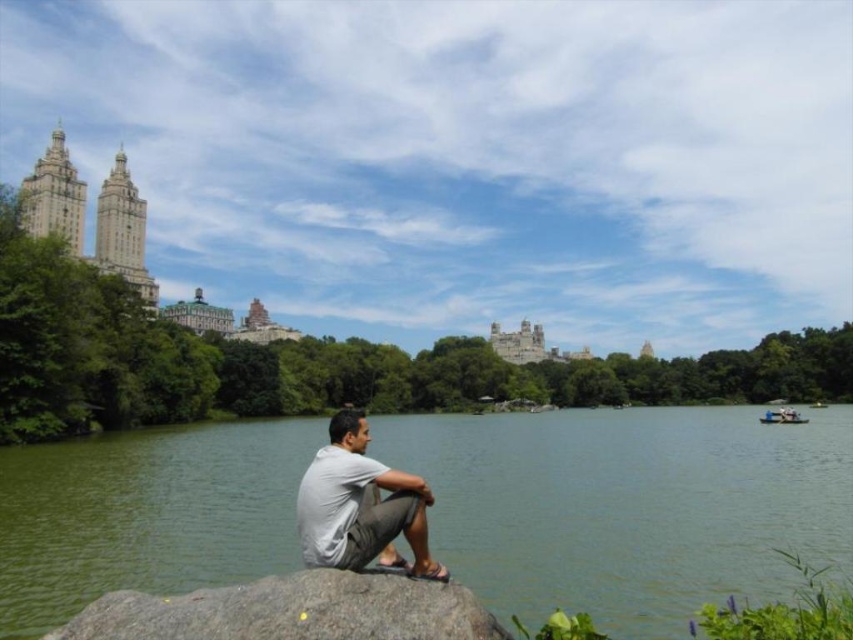
Is green water at lower center in front of gray cotton shirt at lower center?

No.

This screenshot has height=640, width=853. Identify the location of green water at lower center. (628, 506).

Does point (717, 589) lie in front of point (326, 528)?

No, (717, 589) is further to viewer.

The height and width of the screenshot is (640, 853). I want to click on green water at lower center, so click(x=628, y=506).

Looking at this image, can you confirm if gray granite rock at lower center is positioned to the right of gray cotton shirt at lower center?

No, gray granite rock at lower center is not to the right of gray cotton shirt at lower center.

Which is behind, point (358, 621) or point (323, 486)?

The point (323, 486) is more distant.

Is point (262, 604) less distant than point (370, 477)?

Yes, it is in front of point (370, 477).

At what (x,y) coordinates should I click in order to perform the action: click on gray granite rock at lower center. Please return your answer as a coordinate pair (x, y). Looking at the image, I should click on (292, 611).

Which of these two, green water at lower center or gray granite rock at lower center, stands shorter?

Standing shorter between the two is gray granite rock at lower center.

Between green water at lower center and gray granite rock at lower center, which one appears on the left side from the viewer's perspective?

From the viewer's perspective, gray granite rock at lower center appears more on the left side.

Which is in front, point (762, 552) or point (180, 596)?

Positioned in front is point (180, 596).

Where is `green water at lower center`? This screenshot has height=640, width=853. green water at lower center is located at coordinates click(x=628, y=506).